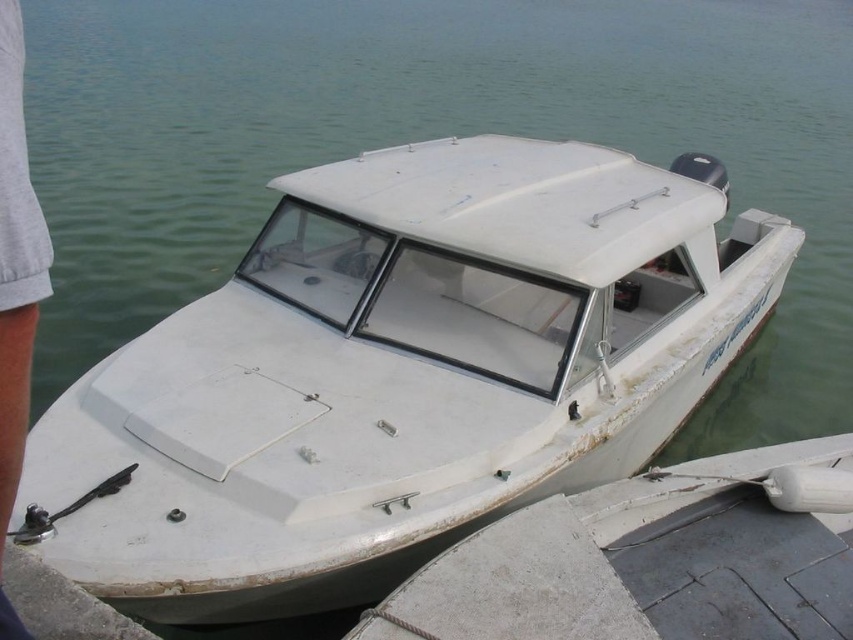
Question: Based on their relative distances, which object is nearer to the white matte boat at center?

Choices:
 (A) gray cotton pants at lower left
 (B) gray concrete dock at lower right

Answer: (B)

Question: Is white matte boat at center wider than gray cotton pants at lower left?

Choices:
 (A) no
 (B) yes

Answer: (B)

Question: Based on their relative distances, which object is nearer to the gray concrete dock at lower right?

Choices:
 (A) white matte boat at center
 (B) gray cotton pants at lower left

Answer: (A)

Question: Which object is positioned closest to the gray cotton pants at lower left?

Choices:
 (A) gray concrete dock at lower right
 (B) white matte boat at center

Answer: (A)

Question: Can you confirm if white matte boat at center is thinner than gray concrete dock at lower right?

Choices:
 (A) yes
 (B) no

Answer: (B)

Question: Considering the relative positions of white matte boat at center and gray cotton pants at lower left in the image provided, where is white matte boat at center located with respect to gray cotton pants at lower left?

Choices:
 (A) left
 (B) right

Answer: (B)